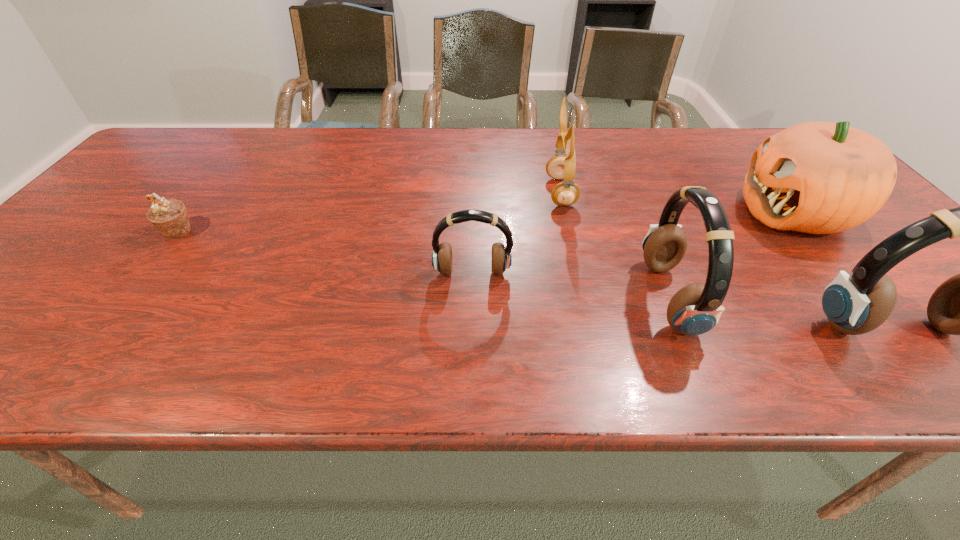
Identify the location of object at the right edge. (817, 177).

In the image, there is a desktop. At what (x,y) coordinates should I click in order to perform the action: click on vacant space at the far edge. Please return your answer as a coordinate pair (x, y). The image size is (960, 540). Looking at the image, I should click on (321, 164).

Locate an element on the screen. vacant space at the near edge is located at coordinates (407, 306).

This screenshot has width=960, height=540. What are the coordinates of `vacant point at the left edge` in the screenshot? It's located at (77, 255).

Identify the location of empty location between the second headset from left to right and the earphone. This screenshot has height=540, width=960. (614, 245).

Find the location of a particular element. This screenshot has height=540, width=960. free space between the fourth object from left to right and the third object from left to right is located at coordinates coord(614,245).

Locate an element on the screen. free space between the leftmost object and the third object from left to right is located at coordinates (370, 212).

Find the location of `unoccupied position between the fifth object from right to left and the leftmost object`. unoccupied position between the fifth object from right to left and the leftmost object is located at coordinates (325, 252).

Where is `free space between the second shortest headset and the third object from left to right`? free space between the second shortest headset and the third object from left to right is located at coordinates (614, 245).

Image resolution: width=960 pixels, height=540 pixels. Identify the location of free space that is in between the fourth object from left to right and the leftmost headset. (570, 286).